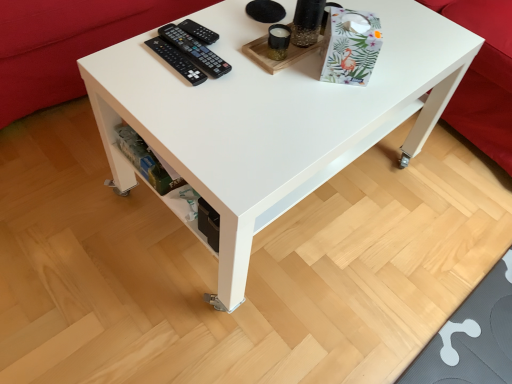
The width and height of the screenshot is (512, 384). I want to click on vacant space to the right of white glossy table at center, so click(x=434, y=234).